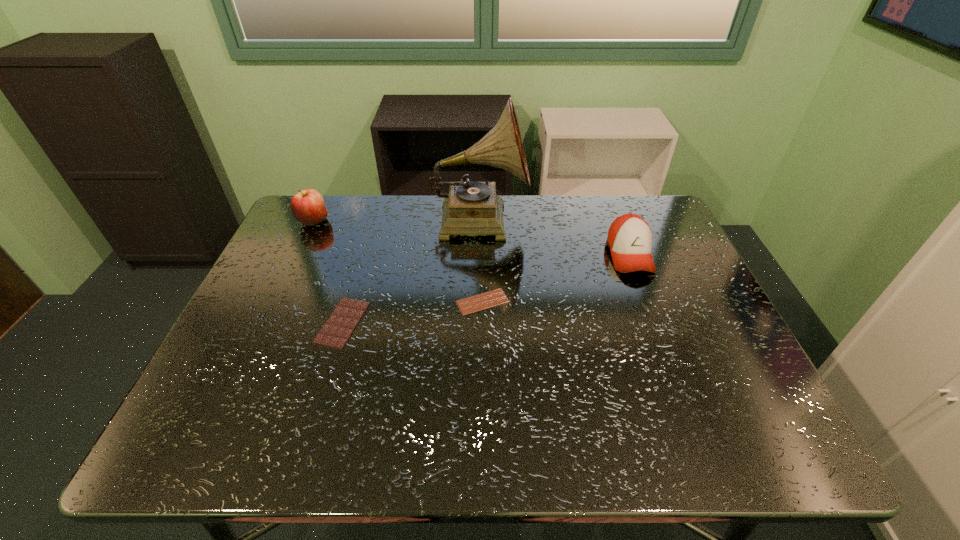
Locate an element on the screen. This screenshot has width=960, height=540. free space that satisfies the following two spatial constraints: 1. on the front side of the apple; 2. on the right side of the shorter chocolate bar is located at coordinates (276, 302).

At what (x,y) coordinates should I click in order to perform the action: click on free location that satisfies the following two spatial constraints: 1. from the horn of the record player; 2. on the front side of the leftmost object. Please return your answer as a coordinate pair (x, y). This screenshot has width=960, height=540. Looking at the image, I should click on [x=479, y=221].

You are a GUI agent. You are given a task and a screenshot of the screen. Output one action in this format:
    pyautogui.click(x=<x>, y=<y>)
    Task: Click on the vacant space that satisfies the following two spatial constraints: 1. on the front side of the leftmost object; 2. on the left side of the right chocolate bar
    The image size is (960, 540).
    Given the screenshot: What is the action you would take?
    pyautogui.click(x=276, y=302)